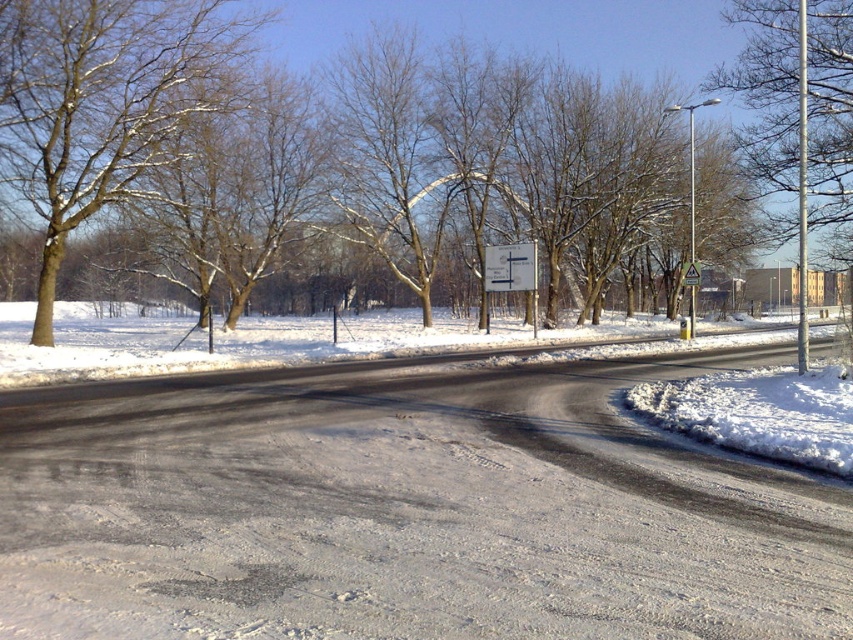
Question: Which point is closer to the camera?

Choices:
 (A) (509, 266)
 (B) (77, 156)
 (C) (767, 161)

Answer: (B)

Question: Is snow-covered branches at upper left bigger than metallic triangular warning sign at center?

Choices:
 (A) yes
 (B) no

Answer: (A)

Question: Which is nearer to the metallic triangular sign at upper right?

Choices:
 (A) white fluffy snow at lower right
 (B) snowy bare tree at upper right
 (C) white plastic sign at center

Answer: (C)

Question: Which point is farther to the camera?

Choices:
 (A) (515, 284)
 (B) (427, 616)
 (C) (683, 269)
 (D) (695, 285)

Answer: (C)

Question: Considering the relative positions of snow-covered branches at upper left and white plastic sign at center in the image provided, where is snow-covered branches at upper left located with respect to white plastic sign at center?

Choices:
 (A) above
 (B) below

Answer: (A)

Question: Can you confirm if snowy bare tree at upper right is bigger than metallic triangular sign at upper right?

Choices:
 (A) yes
 (B) no

Answer: (A)